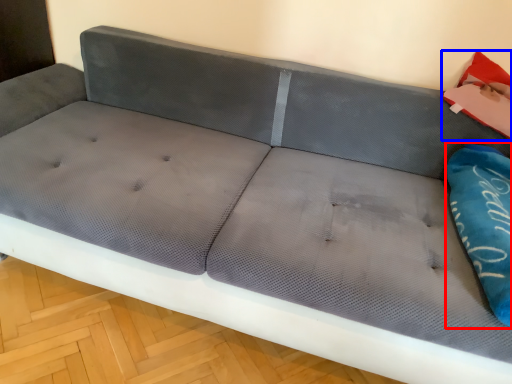
Question: Which of the following is the farthest to the observer, pillow (highlighted by a red box) or material (highlighted by a blue box)?

Choices:
 (A) pillow
 (B) material

Answer: (B)